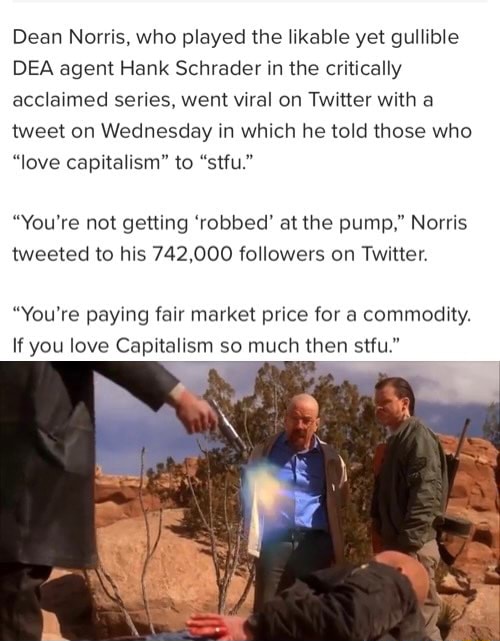
I want to click on coat, so click(41, 401).